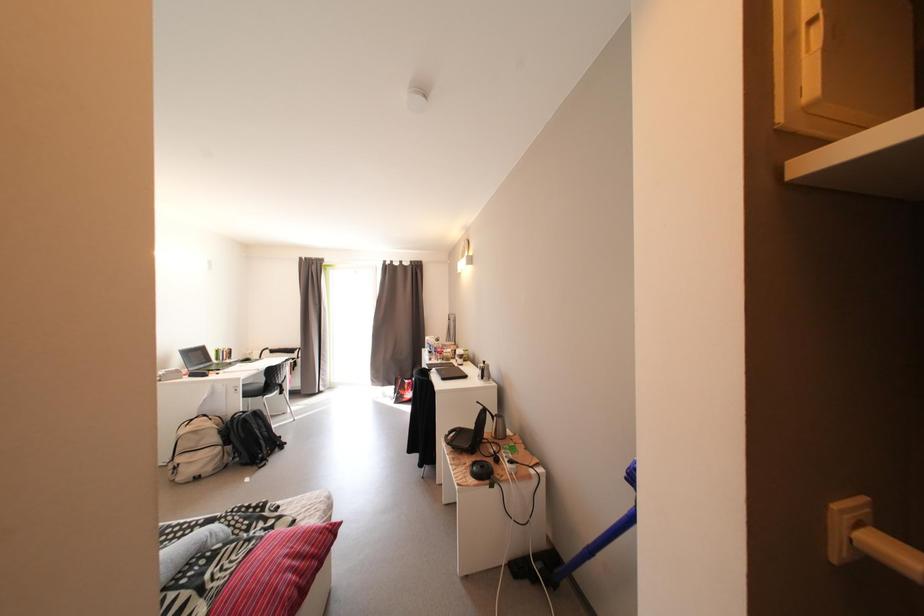
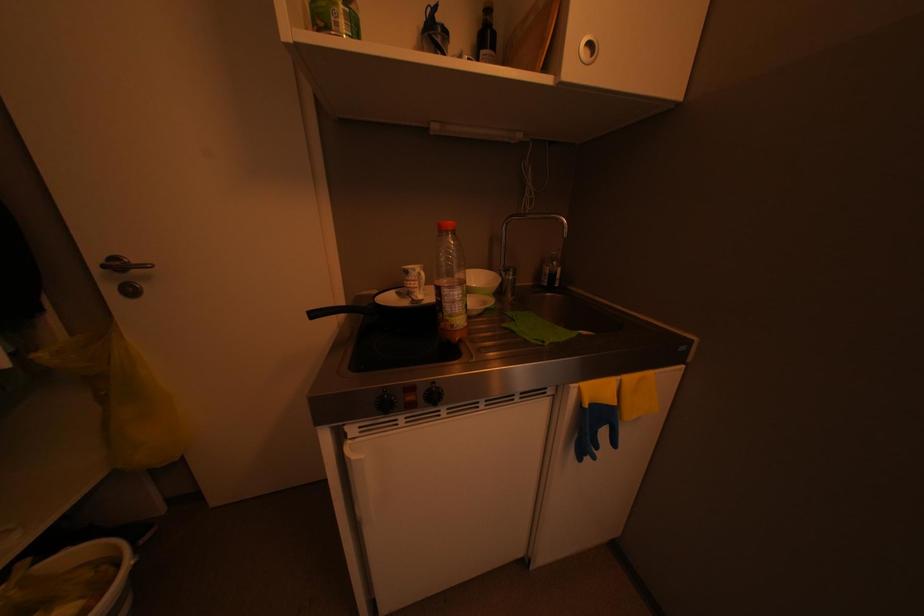
Based on the continuous images, in which direction is the camera rotating?

The rotation direction of the camera is left-down.